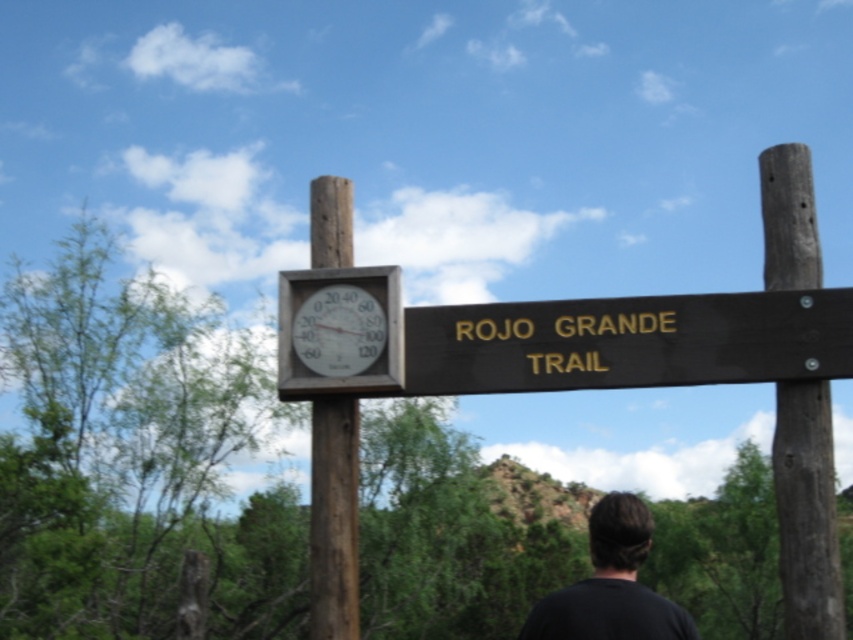
Is brown wood post at right taller than white plastic clock at upper center?

Incorrect, brown wood post at right's height is not larger of white plastic clock at upper center's.

Is brown wood post at right behind white plastic clock at upper center?

Yes.

Is point (788, 236) in front of point (335, 346)?

Yes, it is.

Find the location of a particular element. brown wood post at right is located at coordinates (805, 509).

Describe the element at coordinates (334, 516) in the screenshot. I see `brown rough wood pole at center` at that location.

Who is more distant from viewer, [325,221] or [338,317]?

Point [325,221]

Does point (314, 426) come in front of point (309, 330)?

That is False.

In order to click on brown rough wood pole at center in this screenshot , I will do `click(334, 516)`.

Is brown wooden sign at center below black matte shirt at lower center?

Actually, brown wooden sign at center is above black matte shirt at lower center.

Between brown wooden sign at center and black matte shirt at lower center, which one has less height?

brown wooden sign at center

The width and height of the screenshot is (853, 640). I want to click on brown wooden sign at center, so click(628, 340).